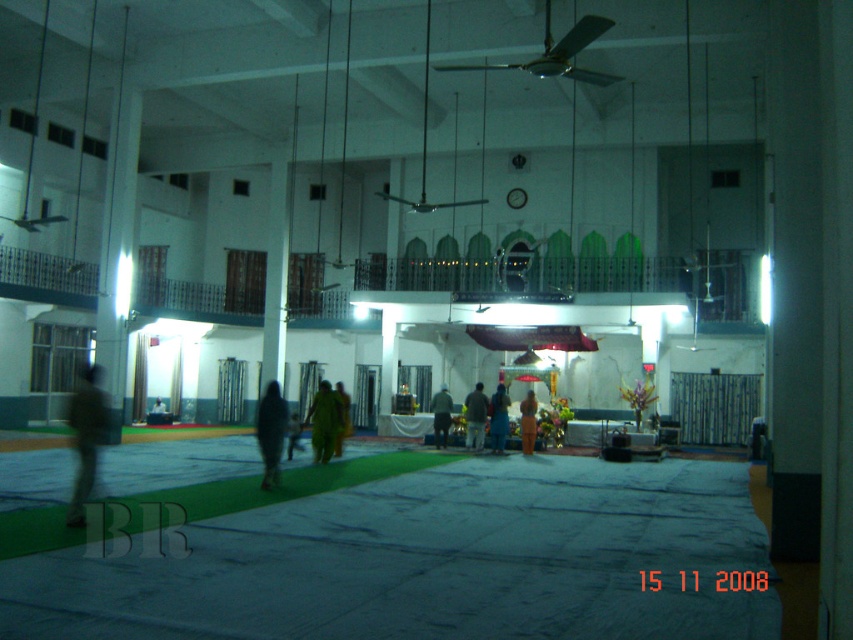
Between dark green fabric at left and yellow fabric cloth at center, which one is positioned higher?

dark green fabric at left is above.

This screenshot has width=853, height=640. In order to click on dark green fabric at left in this screenshot , I will do `click(86, 436)`.

Locate an element on the screen. The height and width of the screenshot is (640, 853). dark green fabric at left is located at coordinates (86, 436).

Identify the location of dark green fabric at left. (86, 436).

Who is positioned more to the right, green fabric dress at center or yellow fabric cloth at center?

Positioned to the right is yellow fabric cloth at center.

Is green fabric dress at center bigger than yellow fabric cloth at center?

Yes.

I want to click on green fabric dress at center, so click(x=323, y=420).

Can you confirm if dark matte clothing at center is shorter than yellow fabric cloth at center?

No.

In the scene shown: Who is positioned more to the right, dark matte clothing at center or yellow fabric cloth at center?

yellow fabric cloth at center

Is point (264, 476) closer to camera compared to point (448, 403)?

Yes, it is.

Locate an element on the screen. The width and height of the screenshot is (853, 640). dark matte clothing at center is located at coordinates (271, 433).